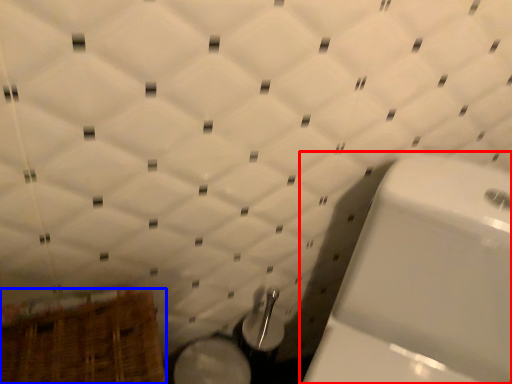
Question: Which object appears closest to the camera in this image, toilet (highlighted by a red box) or basket (highlighted by a blue box)?

Choices:
 (A) toilet
 (B) basket

Answer: (A)